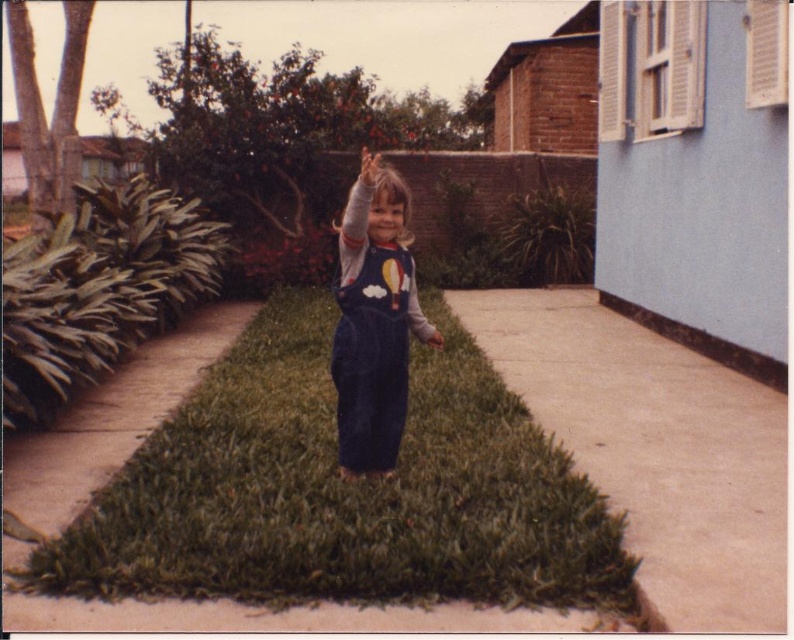
Between green grass at center and smooth concrete pavement at center, which one appears on the right side from the viewer's perspective?

Positioned to the right is smooth concrete pavement at center.

Is green grass at center closer to camera compared to smooth concrete pavement at center?

Yes, green grass at center is closer to the viewer.

Which is behind, point (284, 372) or point (542, 332)?

The point (542, 332) is more distant.

Where is `green grass at center`? The image size is (794, 640). green grass at center is located at coordinates (342, 490).

The height and width of the screenshot is (640, 794). What do you see at coordinates (654, 448) in the screenshot? I see `smooth concrete pavement at center` at bounding box center [654, 448].

Locate an element on the screen. The image size is (794, 640). smooth concrete pavement at center is located at coordinates (654, 448).

Find the location of `smooth concrete pavement at center`. smooth concrete pavement at center is located at coordinates (654, 448).

Is point (476, 440) closer to camera compared to point (357, 250)?

No, it is not.

Where is `green grass at center`? The image size is (794, 640). green grass at center is located at coordinates (342, 490).